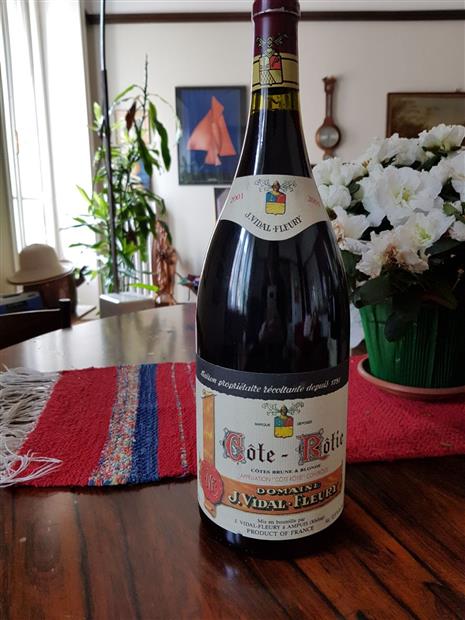
Locate an element on the screen. green vase is located at coordinates (419, 352).